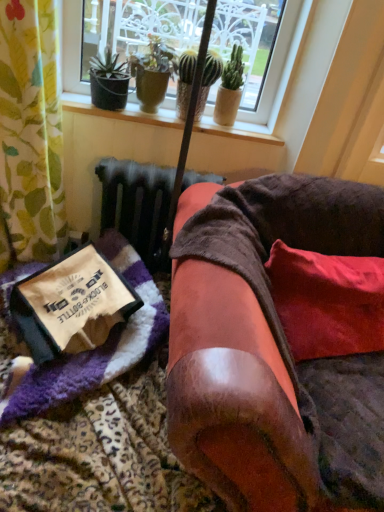
Question: Considering the relative positions of green textured cactus at upper center, the second houseplant in the left-to-right sequence, and red velvet pillow at lower right in the image provided, is green textured cactus at upper center, the second houseplant in the left-to-right sequence, to the right of red velvet pillow at lower right from the viewer's perspective?

Choices:
 (A) no
 (B) yes

Answer: (A)

Question: Could you tell me if green textured cactus at upper center, the second houseplant in the left-to-right sequence, is turned towards red velvet pillow at lower right?

Choices:
 (A) no
 (B) yes

Answer: (A)

Question: Does green textured cactus at upper center, the second houseplant in the left-to-right sequence, appear on the left side of red velvet pillow at lower right?

Choices:
 (A) yes
 (B) no

Answer: (A)

Question: Is green textured cactus at upper center, the second houseplant in the left-to-right sequence, closer to camera compared to red velvet pillow at lower right?

Choices:
 (A) yes
 (B) no

Answer: (B)

Question: Would you say green textured cactus at upper center, which is the second houseplant in right-to-left order, is outside red velvet pillow at lower right?

Choices:
 (A) no
 (B) yes

Answer: (B)

Question: Based on their sizes in the image, would you say velvet brown armchair at center is bigger or smaller than purple fuzzy blanket at lower left?

Choices:
 (A) small
 (B) big

Answer: (B)

Question: Considering the relative positions of velvet brown armchair at center and purple fuzzy blanket at lower left in the image provided, is velvet brown armchair at center to the left or to the right of purple fuzzy blanket at lower left?

Choices:
 (A) right
 (B) left

Answer: (A)

Question: In the image, is velvet brown armchair at center positioned in front of or behind purple fuzzy blanket at lower left?

Choices:
 (A) behind
 (B) front

Answer: (B)

Question: In terms of height, does velvet brown armchair at center look taller or shorter compared to purple fuzzy blanket at lower left?

Choices:
 (A) tall
 (B) short

Answer: (A)

Question: Does point (208, 70) appear closer or farther from the camera than point (264, 130)?

Choices:
 (A) closer
 (B) farther

Answer: (A)

Question: From the image's perspective, relative to wooden at upper center, is green textured cactus at upper center, the second houseplant in the left-to-right sequence, above or below?

Choices:
 (A) below
 (B) above

Answer: (B)

Question: Considering their positions, is green textured cactus at upper center, which is the second houseplant in right-to-left order, located in front of or behind wooden at upper center?

Choices:
 (A) behind
 (B) front

Answer: (B)

Question: Is green textured cactus at upper center, which is the second houseplant in right-to-left order, situated inside wooden at upper center or outside?

Choices:
 (A) outside
 (B) inside

Answer: (A)

Question: Considering the positions of green matte cactus at upper center, which is the 1th houseplant from right to left, and purple fuzzy blanket at lower left in the image, is green matte cactus at upper center, which is the 1th houseplant from right to left, wider or thinner than purple fuzzy blanket at lower left?

Choices:
 (A) thin
 (B) wide

Answer: (A)

Question: Is point (230, 100) positioned closer to the camera than point (119, 333)?

Choices:
 (A) farther
 (B) closer

Answer: (A)